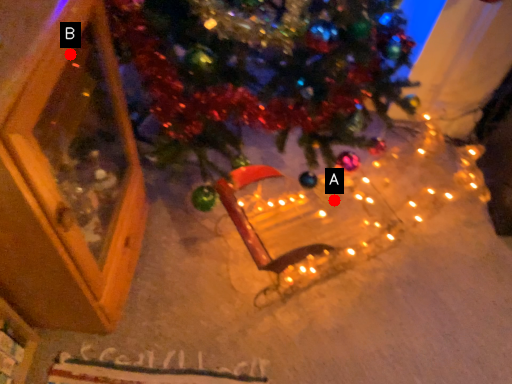
Question: Two points are circled on the image, labeled by A and B beside each circle. Which of the following is the closest to the observer?

Choices:
 (A) A is closer
 (B) B is closer

Answer: (B)